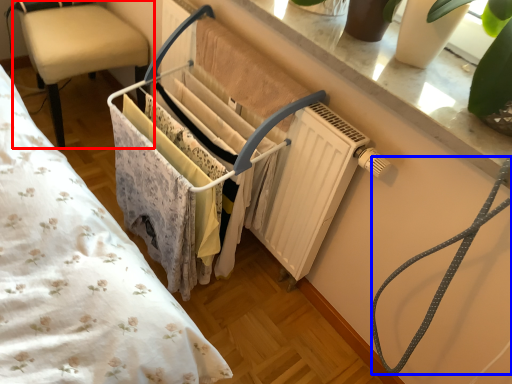
Question: Which of the following is the farthest to the observer, chair (highlighted by a red box) or twin (highlighted by a blue box)?

Choices:
 (A) chair
 (B) twin

Answer: (A)